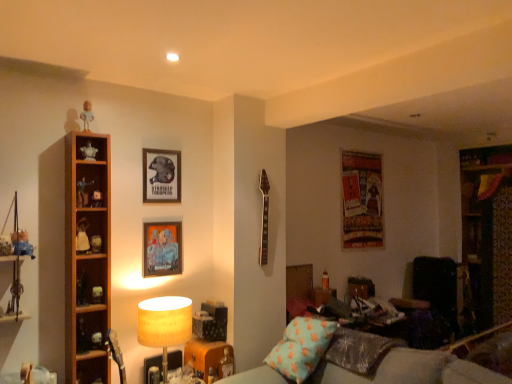
Question: Considering the relative sizes of matte black figurine at left, arranged as the fourth toy when viewed from the left, and matte white figurine at left, which ranks as the sixth toy in bottom-to-top order, in the image provided, is matte black figurine at left, arranged as the fourth toy when viewed from the left, taller than matte white figurine at left, which ranks as the sixth toy in bottom-to-top order,?

Choices:
 (A) no
 (B) yes

Answer: (B)

Question: Is matte black figurine at left, which is the 9th toy from top to bottom, positioned beyond the bounds of matte white figurine at left, arranged as the 2th toy when viewed from the left?

Choices:
 (A) yes
 (B) no

Answer: (A)

Question: Is matte black figurine at left, arranged as the fourth toy when viewed from the left, positioned with its back to matte white figurine at left, which is counted as the 10th toy, starting from the right?

Choices:
 (A) yes
 (B) no

Answer: (B)

Question: Can you confirm if matte black figurine at left, arranged as the fourth toy when viewed from the left, is bigger than matte white figurine at left, which is counted as the 10th toy, starting from the right?

Choices:
 (A) yes
 (B) no

Answer: (B)

Question: Can you confirm if matte black figurine at left, which is the eighth toy in right-to-left order, is wider than matte white figurine at left, which is counted as the 10th toy, starting from the right?

Choices:
 (A) no
 (B) yes

Answer: (A)

Question: From a real-world perspective, is textured fabric poster at upper right, the 3th picture frame in the left-to-right sequence, positioned above or below white matte figurine at left, the second toy ordered from the bottom?

Choices:
 (A) below
 (B) above

Answer: (B)

Question: Considering the positions of textured fabric poster at upper right, which ranks as the 1th picture frame in right-to-left order, and white matte figurine at left, the second toy ordered from the bottom, in the image, is textured fabric poster at upper right, which ranks as the 1th picture frame in right-to-left order, wider or thinner than white matte figurine at left, the second toy ordered from the bottom,?

Choices:
 (A) wide
 (B) thin

Answer: (B)

Question: Is point (352, 233) closer or farther from the camera than point (92, 299)?

Choices:
 (A) farther
 (B) closer

Answer: (A)

Question: Based on their positions, is textured fabric poster at upper right, the first picture frame viewed from the back, located to the left or right of white matte figurine at left, the tenth toy in the left-to-right sequence?

Choices:
 (A) right
 (B) left

Answer: (A)

Question: In terms of height, does matte plastic picture frame at upper center, marked as the 1th picture frame in a left-to-right arrangement, look taller or shorter compared to matte white figurine at left, which is the eleventh toy in right-to-left order?

Choices:
 (A) tall
 (B) short

Answer: (A)

Question: Based on their positions, is matte plastic picture frame at upper center, the 2th picture frame viewed from the back, located to the left or right of matte white figurine at left, which is the eleventh toy in right-to-left order?

Choices:
 (A) right
 (B) left

Answer: (A)

Question: From a real-world perspective, relative to matte white figurine at left, which is the eleventh toy in right-to-left order, is matte plastic picture frame at upper center, the third picture frame from the right, vertically above or below?

Choices:
 (A) below
 (B) above

Answer: (B)

Question: Is matte plastic picture frame at upper center, marked as the 1th picture frame in a left-to-right arrangement, spatially inside matte white figurine at left, which is counted as the 7th toy, starting from the top, or outside of it?

Choices:
 (A) inside
 (B) outside

Answer: (B)

Question: From a real-world perspective, is white matte figurine at upper left, the first toy viewed from the top, positioned above or below white matte figurine at upper left, positioned as the fifth toy in right-to-left order?

Choices:
 (A) above
 (B) below

Answer: (A)

Question: Is white matte figurine at upper left, the first toy viewed from the top, to the left or to the right of white matte figurine at upper left, the 2th toy when ordered from top to bottom, in the image?

Choices:
 (A) right
 (B) left

Answer: (B)